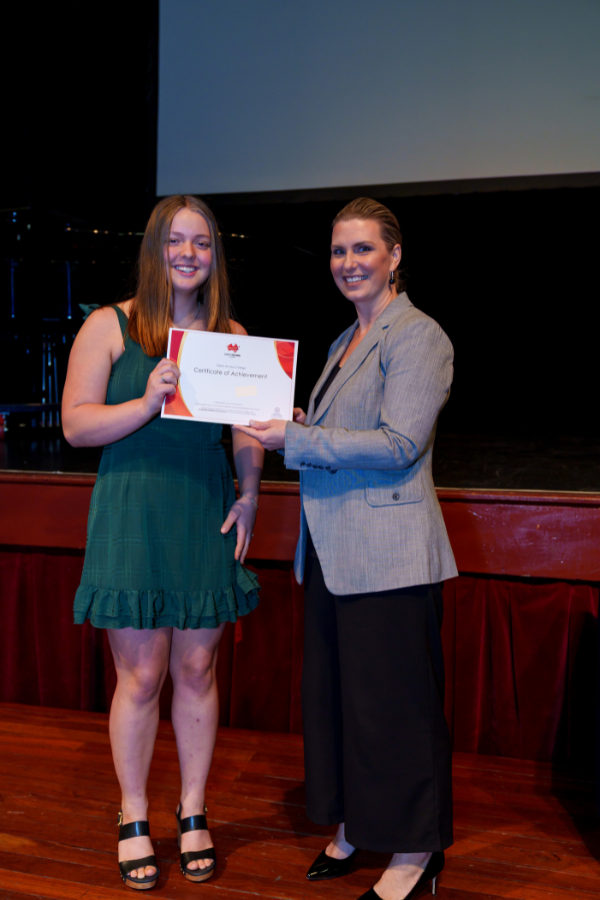
I want to click on stage, so click(554, 489).